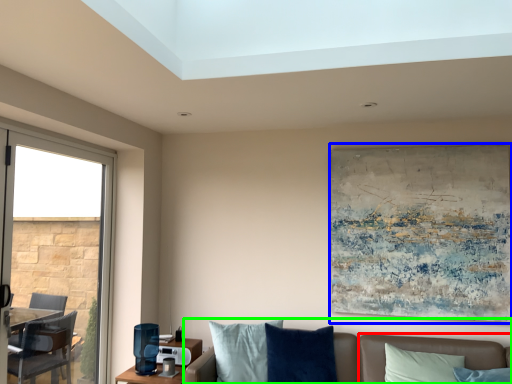
Question: Which object is the closest to the couch (highlighted by a red box)? Choose among these: picture frame (highlighted by a blue box) or studio couch (highlighted by a green box).

Choices:
 (A) picture frame
 (B) studio couch

Answer: (B)